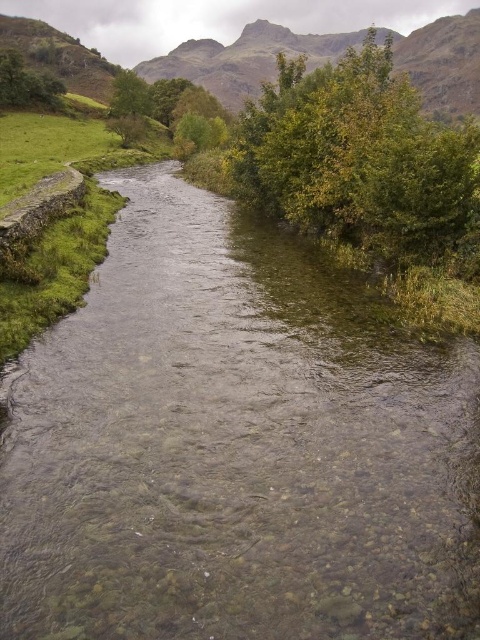
You are a hiker standing at the base of the green leafy tree at upper left and want to reach the green leafy tree at upper center. Given that your average walking pace is 1.5 meters per second, how long will it take you to walk directly between these two trees?

The distance between the green leafy tree at upper center and green leafy tree at upper left is 125.33 meters. At a pace of 1.5 meters per second, it would take approximately 83.55 seconds, which is roughly 1 minute and 24 seconds.

You are an explorer trying to cross the river. You notice the rugged stone mountain at upper center and the green leafy tree at upper left in the background. Which of these two landmarks is wider from your current viewpoint?

The rugged stone mountain at upper center is wider than the green leafy tree at upper left.

You are an explorer trying to cross the river. You see a green leafy tree at upper center and a rugged stone mountain at upper center. Which one is closer to the river?

The green leafy tree at upper center is closer to the river than the rugged stone mountain at upper center because it is smaller in size.